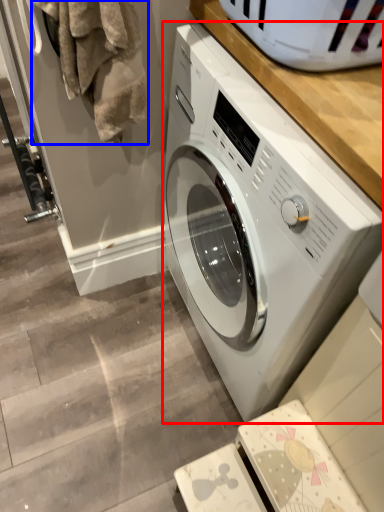
Question: Which object appears closest to the camera in this image, washing machine (highlighted by a red box) or laundry (highlighted by a blue box)?

Choices:
 (A) washing machine
 (B) laundry

Answer: (A)